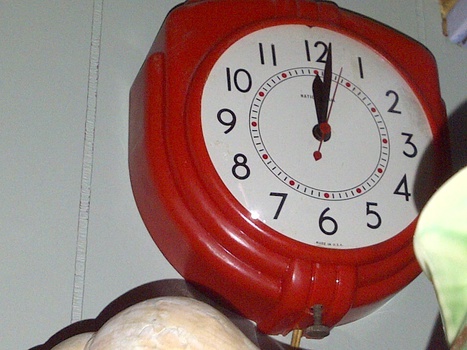
Image resolution: width=467 pixels, height=350 pixels. I want to click on second hand of clock, so click(x=331, y=107).